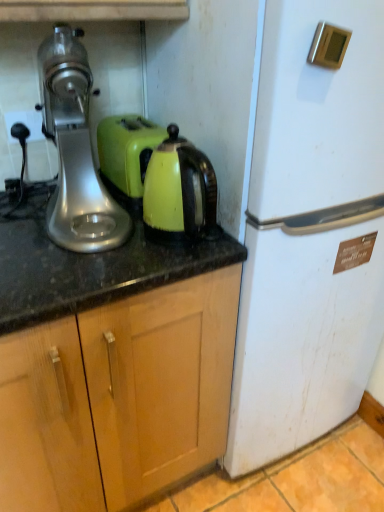
Locate an element on the screen. The height and width of the screenshot is (512, 384). vacant space underneath matte green kettle at center (from a real-world perspective) is located at coordinates (182, 241).